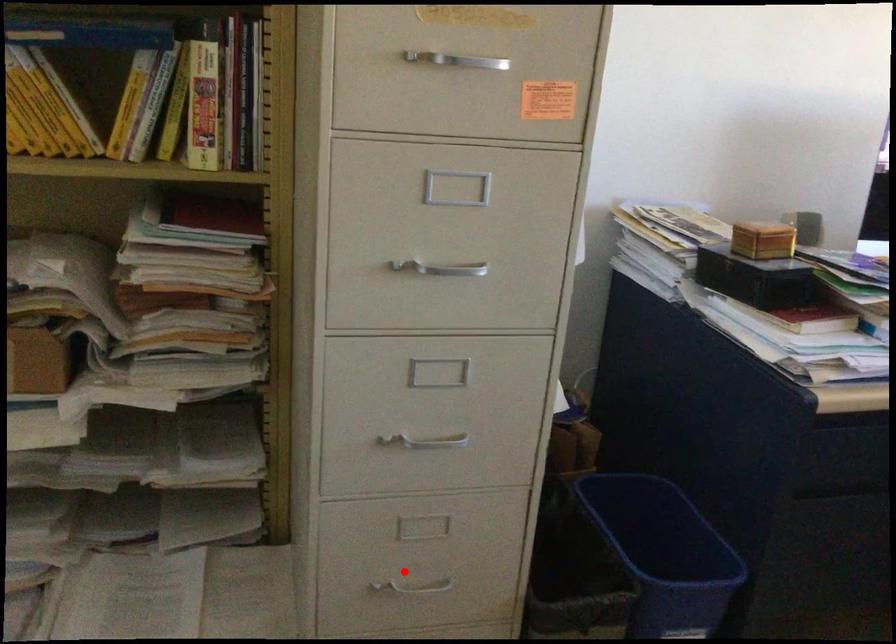
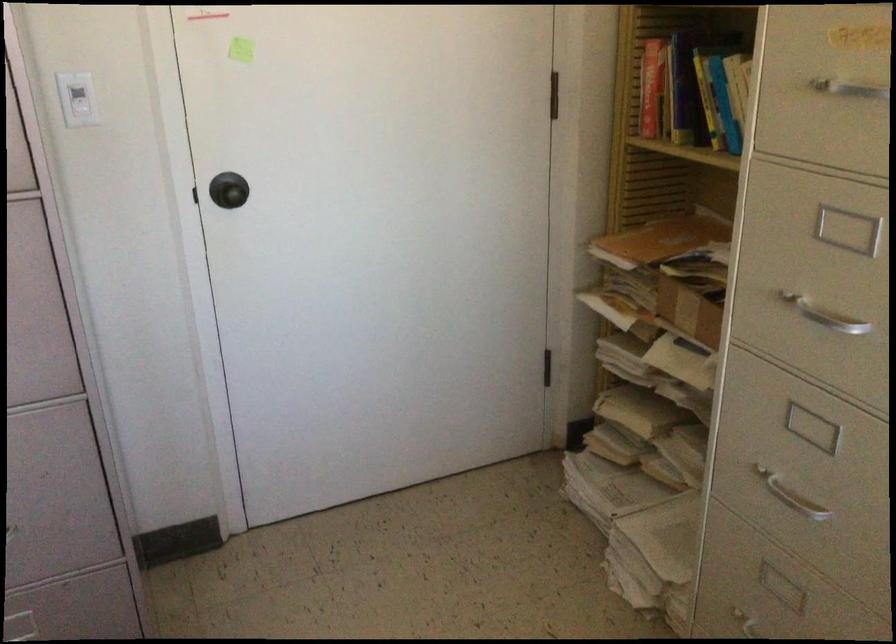
Where in the second image is the point corresponding to the highlighted location from the first image?

(754, 625)